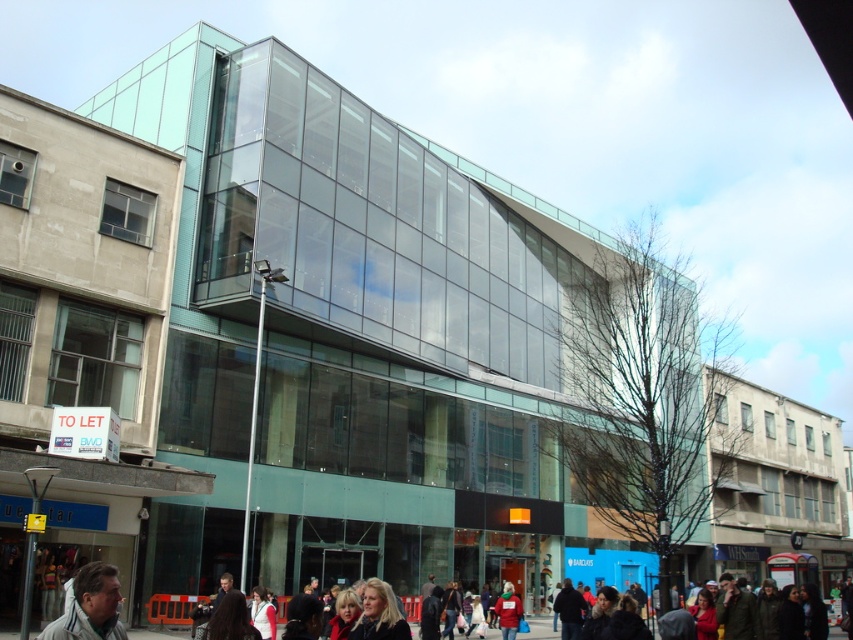
Question: Can you confirm if blonde hair at lower center is positioned above red knit hat at lower center?

Choices:
 (A) yes
 (B) no

Answer: (A)

Question: Which object is the farthest from the gray fabric jacket at lower left?

Choices:
 (A) red knit hat at lower center
 (B) blonde hair at lower center

Answer: (A)

Question: Which of these objects is positioned farthest from the blonde hair at lower center?

Choices:
 (A) red knit hat at lower center
 (B) gray fabric jacket at lower left

Answer: (A)

Question: Is blonde hair at lower center above red knit hat at lower center?

Choices:
 (A) yes
 (B) no

Answer: (A)

Question: Among these objects, which one is farthest from the camera?

Choices:
 (A) gray fabric jacket at lower left
 (B) blonde hair at lower center
 (C) red knit hat at lower center

Answer: (C)

Question: Is gray fabric jacket at lower left to the left of blonde hair at lower center from the viewer's perspective?

Choices:
 (A) yes
 (B) no

Answer: (A)